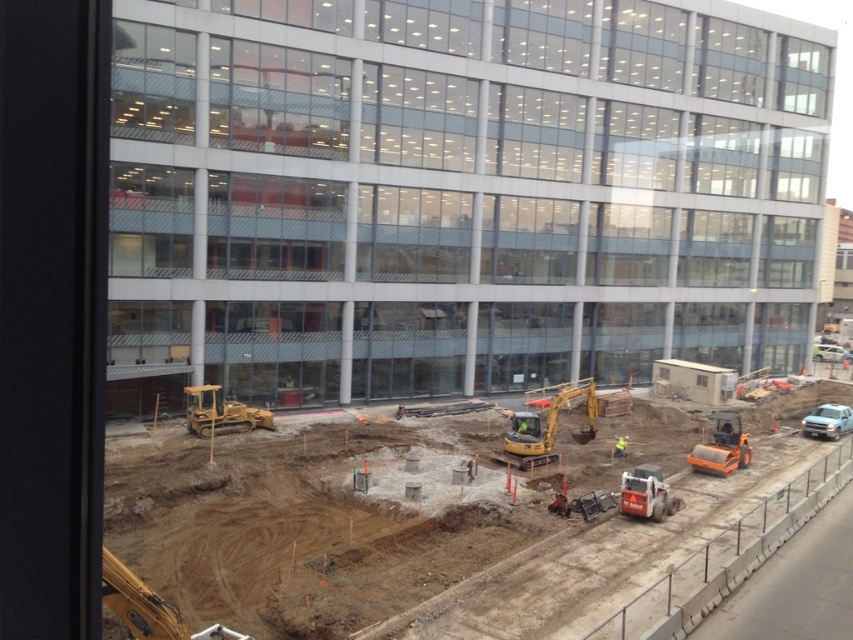
You are a construction worker standing on the brown dirt at lower center. You need to move to the clear glass building at center for a meeting. Which direction should you walk to reach the building?

You should walk upwards towards the clear glass building at center since it is positioned over the brown dirt at lower center.

You are a construction worker standing at the edge of the construction site. You need to move a heavy load from the yellow rubber bulldozer at lower center to the orange rubber skid steer loader at lower right. Which direction should you move the load to ensure it reaches the correct destination?

The yellow rubber bulldozer at lower center is to the left of the orange rubber skid steer loader at lower right, so you should move the load to the right to reach the orange rubber skid steer loader at lower right.

You are a construction worker planning to place a new piece of equipment in the construction site. The equipment requires a flat area larger than the brown dirt at lower center. Can the clear glass building at center provide enough space for this?

The clear glass building at center is larger in size than brown dirt at lower center, but it is a building and not a flat area. Therefore, the clear glass building at center cannot provide the required flat space for the equipment.